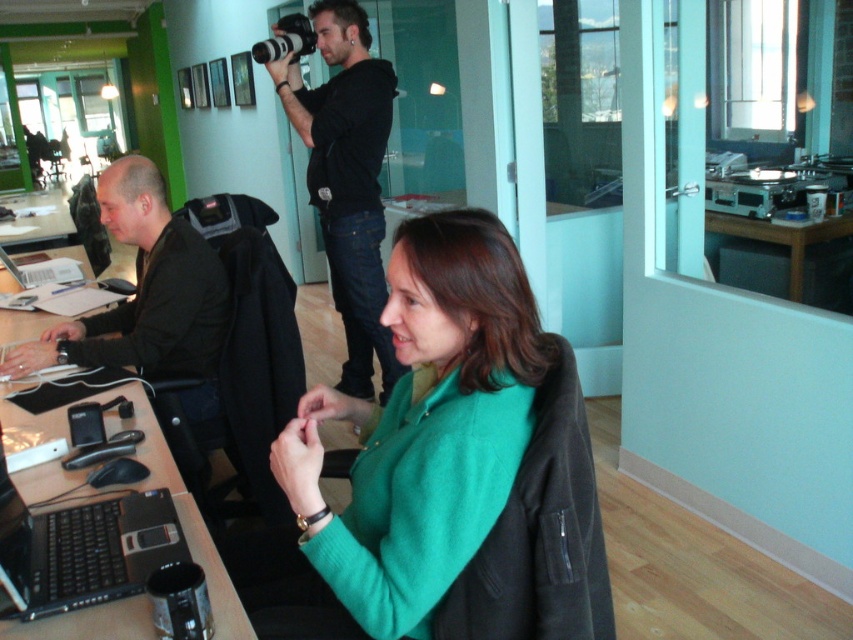
Question: Which point is closer to the camera?

Choices:
 (A) black plastic camera at upper center
 (B) black plastic table at lower left

Answer: (B)

Question: Is green woolen sweater at center bigger than silver metallic laptop at left?

Choices:
 (A) yes
 (B) no

Answer: (A)

Question: From the image, what is the correct spatial relationship of black plastic table at lower left in relation to silver metallic laptop at left?

Choices:
 (A) above
 (B) below

Answer: (B)

Question: Which of the following is the closest to the observer?

Choices:
 (A) (181, 280)
 (B) (277, 42)

Answer: (A)

Question: Is black matte jacket at left bigger than black plastic table at lower left?

Choices:
 (A) no
 (B) yes

Answer: (B)

Question: Which object appears farthest from the camera in this image?

Choices:
 (A) green woolen sweater at center
 (B) silver metallic laptop at left
 (C) black plastic laptop at lower left

Answer: (B)